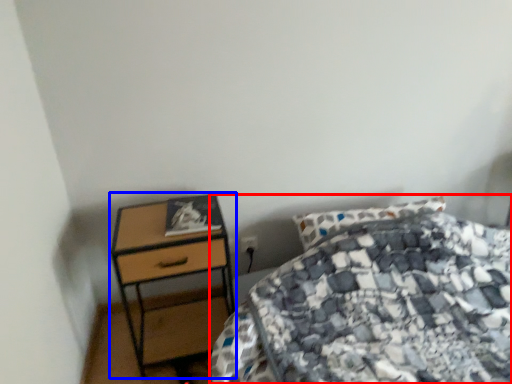
Question: Which point is further to the camera, bed (highlighted by a red box) or nightstand (highlighted by a blue box)?

Choices:
 (A) bed
 (B) nightstand

Answer: (B)